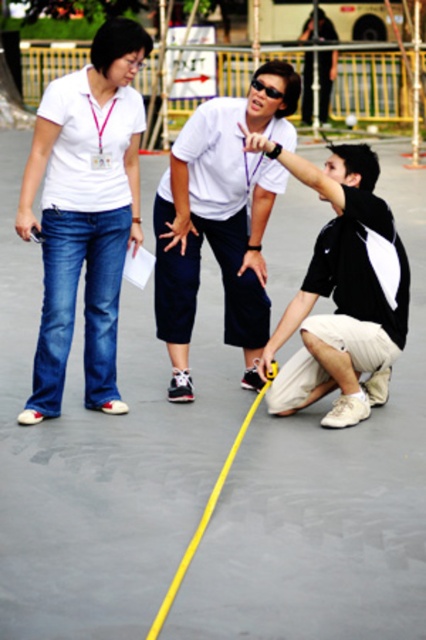
You are a photographer positioned in the scene. You want to take a photo that includes both the matte white shirt at upper left and the black matte tape measure at lower right. Which object should you focus on first to ensure both are in sharp focus?

The matte white shirt at upper left is closer to the viewer than the black matte tape measure at lower right. To ensure both are in sharp focus, focus on the matte white shirt at upper left first, as it is the closer object.